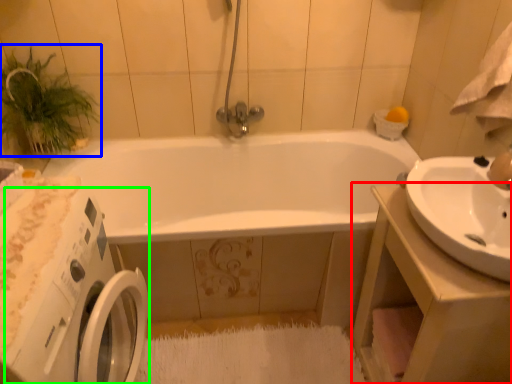
Question: Which object is the closest to the counter top (highlighted by a red box)? Choose among these: plant (highlighted by a blue box) or washing machine (highlighted by a green box).

Choices:
 (A) plant
 (B) washing machine

Answer: (B)